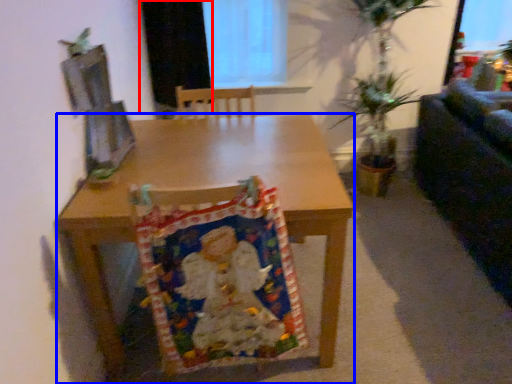
Question: Which object is closer to the camera taking this photo, curtain (highlighted by a red box) or desk (highlighted by a blue box)?

Choices:
 (A) curtain
 (B) desk

Answer: (B)